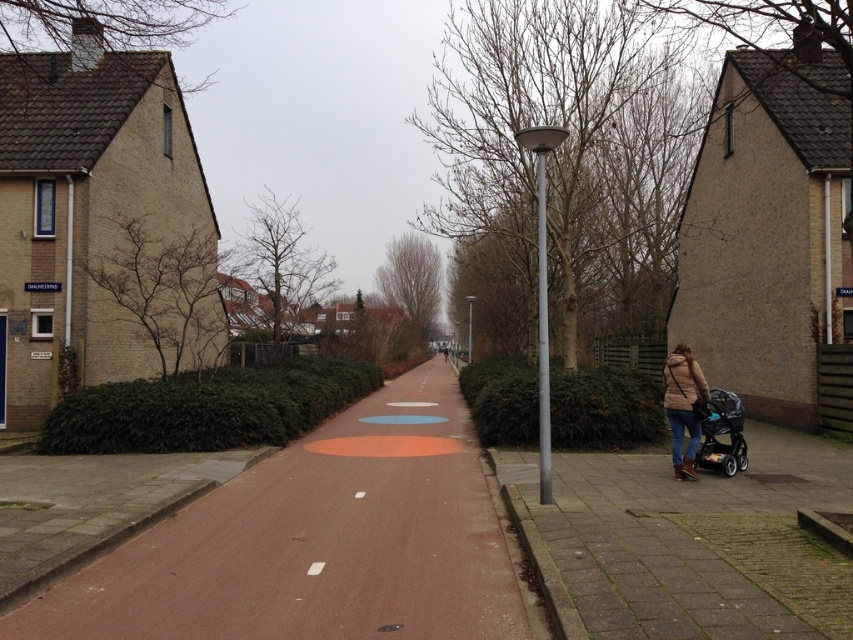
You are standing at the center of the street in the image. You need to find the matte brown jacket at lower right. In which direction should you look to locate it?

The matte brown jacket at lower right is located at point 0.636 on the x axis and 0.802 on the y axis. Since you are standing at the center, you should look to your lower right direction to locate it.

You are a delivery person trying to park your bike between the matte brown jacket at lower right and the matte black stroller at lower right. Can your bike, which is 1 meter wide, fit in the space between them?

The space between the matte brown jacket at lower right and the matte black stroller at lower right is narrower than 1 meter because the jacket is less wide than the stroller, but the total width between them isn